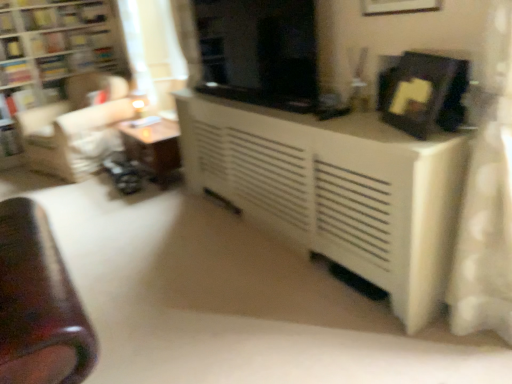
The height and width of the screenshot is (384, 512). Identify the location of wooden table at left, positioned as the first table in left-to-right order. (154, 148).

Find the location of a particular element. white matte book at left, which is counted as the first book, starting from the bottom is located at coordinates (9, 140).

The image size is (512, 384). What do you see at coordinates (19, 100) in the screenshot? I see `hardcover book at left, which is counted as the sixth book, starting from the top` at bounding box center [19, 100].

Measure the distance between black glossy screen door at center and camera.

black glossy screen door at center is 2.02 meters away from camera.

This screenshot has height=384, width=512. I want to click on white matte cabinet at center, which is the 1th table in right-to-left order, so click(336, 190).

Measure the distance between point (142, 58) and camera.

Point (142, 58) is 4.36 meters from camera.

The height and width of the screenshot is (384, 512). Describe the element at coordinates (7, 23) in the screenshot. I see `hardcover book at upper left, which ranks as the second book in top-to-bottom order` at that location.

Find the location of a particular element. This screenshot has width=512, height=384. wooden table at left, arranged as the 2th table when viewed from the right is located at coordinates pyautogui.click(x=154, y=148).

Measure the distance between black matte picture frame at upper right, which is the 1th picture frame in bottom-to-top order, and hardcover book at upper left, placed as the third book when sorted from top to bottom.

black matte picture frame at upper right, which is the 1th picture frame in bottom-to-top order, is 13.66 feet away from hardcover book at upper left, placed as the third book when sorted from top to bottom.

How many degrees apart are the facing directions of black matte picture frame at upper right, which is the 1th picture frame in bottom-to-top order, and hardcover book at upper left, placed as the third book when sorted from top to bottom?

black matte picture frame at upper right, which is the 1th picture frame in bottom-to-top order, and hardcover book at upper left, placed as the third book when sorted from top to bottom, are facing 113 degrees away from each other.

Would you say black matte picture frame at upper right, which is the 1th picture frame in bottom-to-top order, contains hardcover book at upper left, the 5th book from the bottom?

Actually, hardcover book at upper left, the 5th book from the bottom, is outside black matte picture frame at upper right, which is the 1th picture frame in bottom-to-top order.

Does black matte picture frame at upper right, which is the 1th picture frame in bottom-to-top order, turn towards hardcover book at upper left, placed as the third book when sorted from top to bottom?

No, black matte picture frame at upper right, which is the 1th picture frame in bottom-to-top order, is not oriented towards hardcover book at upper left, placed as the third book when sorted from top to bottom.

Can you confirm if matte black picture frame at upper center, arranged as the 2th picture frame when ordered from the bottom, is thinner than black matte picture frame at upper right, which ranks as the 2th picture frame in top-to-bottom order?

Yes.

Is matte black picture frame at upper center, the first picture frame viewed from the top, in front of or behind black matte picture frame at upper right, which is the 1th picture frame in bottom-to-top order, in the image?

matte black picture frame at upper center, the first picture frame viewed from the top, is positioned farther from the viewer than black matte picture frame at upper right, which is the 1th picture frame in bottom-to-top order.

From a real-world perspective, is matte black picture frame at upper center, the first picture frame viewed from the top, physically below black matte picture frame at upper right, which ranks as the 2th picture frame in top-to-bottom order?

Incorrect, from a real-world perspective, matte black picture frame at upper center, the first picture frame viewed from the top, is higher than black matte picture frame at upper right, which ranks as the 2th picture frame in top-to-bottom order.

Considering the sizes of objects matte black picture frame at upper center, arranged as the 2th picture frame when ordered from the bottom, and black matte picture frame at upper right, which ranks as the 2th picture frame in top-to-bottom order, in the image provided, who is taller, matte black picture frame at upper center, arranged as the 2th picture frame when ordered from the bottom, or black matte picture frame at upper right, which ranks as the 2th picture frame in top-to-bottom order,?

Standing taller between the two is matte black picture frame at upper center, arranged as the 2th picture frame when ordered from the bottom.

From a real-world perspective, is wooden bookshelf at left physically below wooden table at left, marked as the first table in a back-to-front arrangement?

No, from a real-world perspective, wooden bookshelf at left is not beneath wooden table at left, marked as the first table in a back-to-front arrangement.

Does point (89, 28) come closer to viewer compared to point (152, 127)?

No.

Consider the image. Does wooden bookshelf at left have a larger size compared to wooden table at left, marked as the first table in a back-to-front arrangement?

Yes.

Which of these two, wooden bookshelf at left or wooden table at left, positioned as the first table in left-to-right order, stands taller?

wooden bookshelf at left.

Considering the sizes of wooden table at left, arranged as the 2th table when viewed from the right, and hardcover book at upper left, which ranks as the second book in top-to-bottom order, in the image, is wooden table at left, arranged as the 2th table when viewed from the right, wider or thinner than hardcover book at upper left, which ranks as the second book in top-to-bottom order,?

wooden table at left, arranged as the 2th table when viewed from the right, is wider than hardcover book at upper left, which ranks as the second book in top-to-bottom order.

Who is bigger, wooden table at left, positioned as the first table in left-to-right order, or hardcover book at upper left, positioned as the sixth book in bottom-to-top order?

wooden table at left, positioned as the first table in left-to-right order.

At what (x,y) coordinates should I click in order to perform the action: click on the 1st book behind the wooden table at left, positioned as the first table in left-to-right order, counting from the anchor's position. Please return your answer as a coordinate pair (x, y). Looking at the image, I should click on (7, 23).

Who is taller, hardcover book at upper left, the 4th book from the bottom, or hardcover book at upper left, the 1th book in the top-to-bottom sequence?

hardcover book at upper left, the 4th book from the bottom.

Which of these two, hardcover book at upper left, the 4th book from the bottom, or hardcover book at upper left, the 1th book in the top-to-bottom sequence, is thinner?

Thinner between the two is hardcover book at upper left, the 4th book from the bottom.

Considering the relative positions of hardcover book at upper left, the 4th book from the bottom, and hardcover book at upper left, the 1th book in the top-to-bottom sequence, in the image provided, is hardcover book at upper left, the 4th book from the bottom, to the right of hardcover book at upper left, the 1th book in the top-to-bottom sequence, from the viewer's perspective?

No.

Considering the positions of objects hardcover book at upper left, marked as the third book in a bottom-to-top arrangement, and wooden bookshelf at left in the image provided, who is more to the left, hardcover book at upper left, marked as the third book in a bottom-to-top arrangement, or wooden bookshelf at left?

From the viewer's perspective, hardcover book at upper left, marked as the third book in a bottom-to-top arrangement, appears more on the left side.

At what (x,y) coordinates should I click in order to perform the action: click on bookcase lying in front of the hardcover book at upper left, marked as the third book in a bottom-to-top arrangement. Please return your answer as a coordinate pair (x, y). Image resolution: width=512 pixels, height=384 pixels. Looking at the image, I should click on (61, 47).

From the picture: From the image's perspective, who appears lower, hardcover book at upper left, marked as the third book in a bottom-to-top arrangement, or wooden bookshelf at left?

hardcover book at upper left, marked as the third book in a bottom-to-top arrangement.

Does wooden table at left, which is the second table from front to back, have a larger size compared to hardcover book at left, which is counted as the sixth book, starting from the top?

Correct, wooden table at left, which is the second table from front to back, is larger in size than hardcover book at left, which is counted as the sixth book, starting from the top.

Is there a large distance between wooden table at left, arranged as the 2th table when viewed from the right, and hardcover book at left, which is counted as the sixth book, starting from the top?

Yes, wooden table at left, arranged as the 2th table when viewed from the right, and hardcover book at left, which is counted as the sixth book, starting from the top, are located far from each other.

From the picture: Which object is thinner, wooden table at left, which is the second table from front to back, or hardcover book at left, the 2th book when ordered from bottom to top?

With smaller width is hardcover book at left, the 2th book when ordered from bottom to top.

Is wooden table at left, arranged as the 2th table when viewed from the right, at the right side of hardcover book at left, which is counted as the sixth book, starting from the top?

Correct, you'll find wooden table at left, arranged as the 2th table when viewed from the right, to the right of hardcover book at left, which is counted as the sixth book, starting from the top.

From the black matte picture frame at upper right, which ranks as the 2th picture frame in top-to-bottom order, count the 1st book to the left and point to it. Please provide its 2D coordinates.

[(69, 41)]

Identify the location of picture frame that appears below the matte black picture frame at upper center, the first picture frame viewed from the top (from a real-world perspective). The width and height of the screenshot is (512, 384). (424, 94).

Which object lies further to the anchor point black matte picture frame at upper right, which ranks as the 2th picture frame in top-to-bottom order, hardcover book at upper left, marked as the third book in a bottom-to-top arrangement, or hardcover book at upper left, positioned as the sixth book in bottom-to-top order?

The object further to black matte picture frame at upper right, which ranks as the 2th picture frame in top-to-bottom order, is hardcover book at upper left, positioned as the sixth book in bottom-to-top order.

Considering their positions, is hardcover book at upper left, the 4th book when ordered from top to bottom, positioned closer to white matte cabinet at center, the 2th table positioned from the left, than hardcover book at upper left, positioned as the sixth book in bottom-to-top order?

Among the two, hardcover book at upper left, the 4th book when ordered from top to bottom, is located nearer to white matte cabinet at center, the 2th table positioned from the left.

Looking at the image, which one is located further to hardcover book at left, which is counted as the sixth book, starting from the top, matte black picture frame at upper center, the first picture frame viewed from the top, or hardcover book at upper left, which is the fifth book from top to bottom?

Based on the image, matte black picture frame at upper center, the first picture frame viewed from the top, appears to be further to hardcover book at left, which is counted as the sixth book, starting from the top.

Considering their positions, is hardcover book at upper left, the 4th book when ordered from top to bottom, positioned further to matte black picture frame at upper center, arranged as the 2th picture frame when ordered from the bottom, than hardcover book at upper left, which is the fifth book from top to bottom?

The object further to matte black picture frame at upper center, arranged as the 2th picture frame when ordered from the bottom, is hardcover book at upper left, which is the fifth book from top to bottom.

From the image, which object appears to be nearer to wooden bookshelf at left, hardcover book at upper left, which ranks as the second book in top-to-bottom order, or hardcover book at upper left, marked as the third book in a bottom-to-top arrangement?

hardcover book at upper left, marked as the third book in a bottom-to-top arrangement, is closer to wooden bookshelf at left.

From the image, which object appears to be farther from black matte picture frame at upper right, which ranks as the 2th picture frame in top-to-bottom order, hardcover book at upper left, which is the 7th book from bottom to top, or black glossy screen door at center?

Among the two, hardcover book at upper left, which is the 7th book from bottom to top, is located further to black matte picture frame at upper right, which ranks as the 2th picture frame in top-to-bottom order.

Estimate the real-world distances between objects in this image. Which object is further from wooden table at left, positioned as the first table in left-to-right order, hardcover book at upper left, the 4th book from the bottom, or hardcover book at upper left, the 1th book in the top-to-bottom sequence?

hardcover book at upper left, the 4th book from the bottom, is further to wooden table at left, positioned as the first table in left-to-right order.

When comparing their distances from hardcover book at upper left, placed as the third book when sorted from top to bottom, does wooden table at left, positioned as the first table in left-to-right order, or white matte book at left, acting as the seventh book starting from the top, seem further?

The object further to hardcover book at upper left, placed as the third book when sorted from top to bottom, is wooden table at left, positioned as the first table in left-to-right order.

Where is `bookcase situated between white matte book at left, which is counted as the first book, starting from the bottom, and wooden table at left, positioned as the first table in left-to-right order, from left to right`? The height and width of the screenshot is (384, 512). bookcase situated between white matte book at left, which is counted as the first book, starting from the bottom, and wooden table at left, positioned as the first table in left-to-right order, from left to right is located at coordinates (61, 47).

Where is `picture frame located between white matte cabinet at center, the 2th table positioned from the left, and hardcover book at upper left, placed as the third book when sorted from top to bottom, in the depth direction`? picture frame located between white matte cabinet at center, the 2th table positioned from the left, and hardcover book at upper left, placed as the third book when sorted from top to bottom, in the depth direction is located at coordinates (398, 6).

At what (x,y) coordinates should I click in order to perform the action: click on table between white matte cabinet at center, the 1th table positioned from the front, and white matte book at left, acting as the seventh book starting from the top, along the z-axis. Please return your answer as a coordinate pair (x, y). The image size is (512, 384). Looking at the image, I should click on (154, 148).

Where is `bookcase between hardcover book at upper left, which ranks as the second book in top-to-bottom order, and hardcover book at upper left, marked as the third book in a bottom-to-top arrangement, from top to bottom`? bookcase between hardcover book at upper left, which ranks as the second book in top-to-bottom order, and hardcover book at upper left, marked as the third book in a bottom-to-top arrangement, from top to bottom is located at coordinates (61, 47).